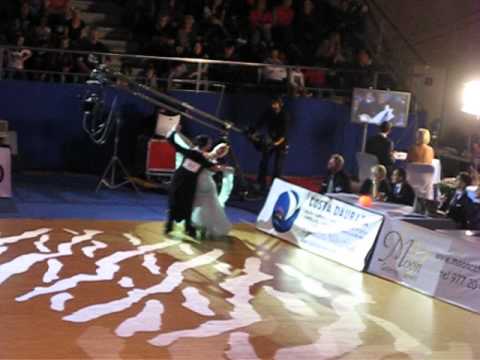
Find the location of `floor`. floor is located at coordinates (180, 308).